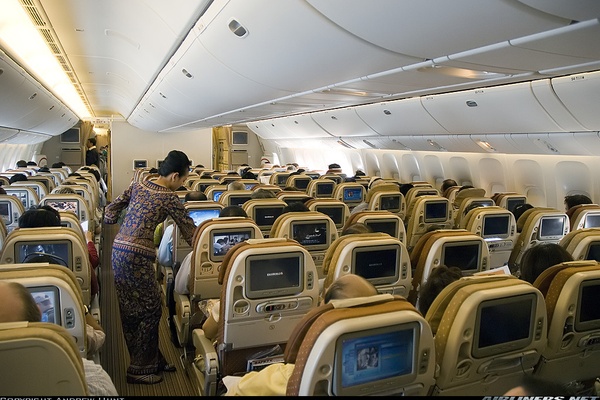
Locate an element on the screen. outlets usb is located at coordinates (310, 286), (276, 307), (78, 266), (71, 313), (424, 360), (540, 328).